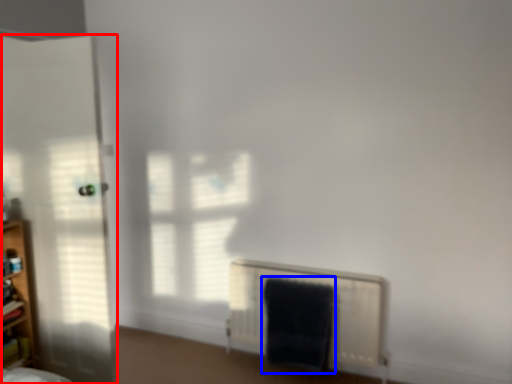
Question: Which object appears closest to the camera in this image, door (highlighted by a red box) or bath towel (highlighted by a blue box)?

Choices:
 (A) door
 (B) bath towel

Answer: (A)